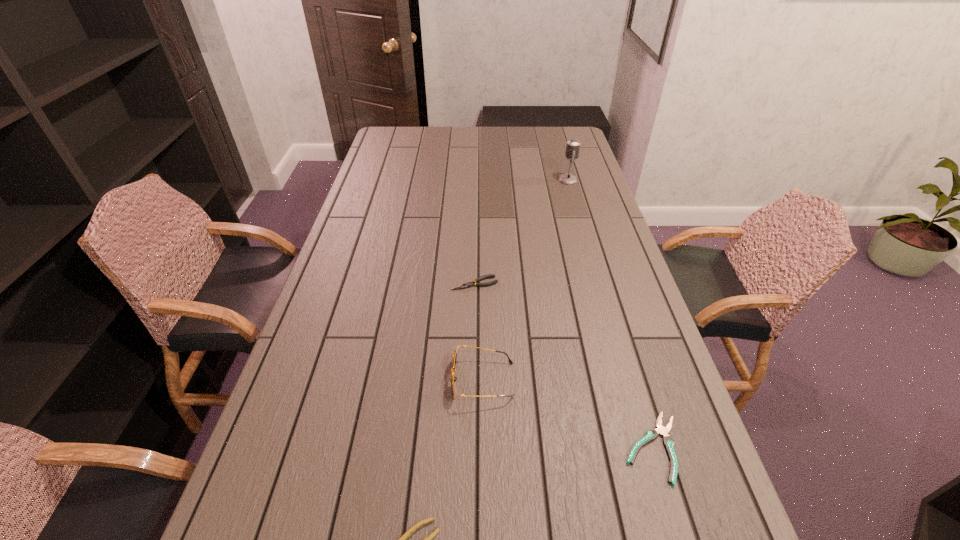
Image resolution: width=960 pixels, height=540 pixels. Identify the location of the farthest object. (573, 145).

At what (x,y) coordinates should I click in order to perform the action: click on the tallest object. Please return your answer as a coordinate pair (x, y). The width and height of the screenshot is (960, 540). Looking at the image, I should click on (573, 145).

You are a GUI agent. You are given a task and a screenshot of the screen. Output one action in this format:
    pyautogui.click(x=<x>, y=<y>)
    Task: Click on the third nearest object
    The image size is (960, 540).
    Given the screenshot: What is the action you would take?
    pyautogui.click(x=453, y=378)

Where is `the fourth shortest object`? The height and width of the screenshot is (540, 960). the fourth shortest object is located at coordinates (453, 378).

Image resolution: width=960 pixels, height=540 pixels. I want to click on the tallest pliers, so click(469, 284).

Identify the location of the third tallest object. This screenshot has width=960, height=540. (469, 284).

Where is `the rightmost pliers`? Image resolution: width=960 pixels, height=540 pixels. the rightmost pliers is located at coordinates [652, 434].

The width and height of the screenshot is (960, 540). What are the coordinates of `the fourth farthest object` in the screenshot? It's located at (652, 434).

Locate an element on the screen. The height and width of the screenshot is (540, 960). free space located 0.280m on the left of the tallest object is located at coordinates (489, 180).

Locate an element on the screen. free spot located on the front-facing side of the fourth shortest object is located at coordinates (389, 380).